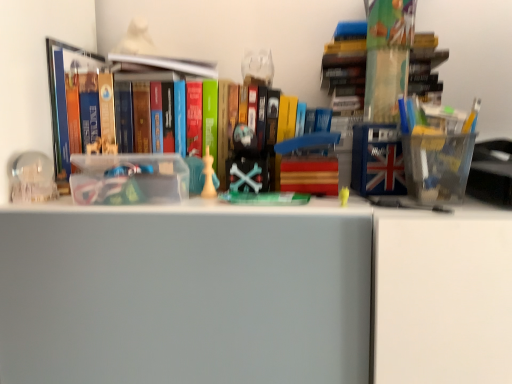
Question: From a real-world perspective, is transparent glass sphere at left, which appears as the 2th toy when viewed from the right, physically located above or below hardcover book at center, which ranks as the 2th book in left-to-right order?

Choices:
 (A) above
 (B) below

Answer: (B)

Question: Looking at the image, does transparent glass sphere at left, the 1th toy when ordered from left to right, seem bigger or smaller compared to hardcover book at center, which ranks as the 2th book in left-to-right order?

Choices:
 (A) big
 (B) small

Answer: (B)

Question: Based on their relative distances, which object is farther from the hardcover book at center, which is the 2th book from right to left?

Choices:
 (A) transparent glass sphere at left, which appears as the 2th toy when viewed from the right
 (B) white matte chess piece at center, which appears as the first toy when viewed from the right
 (C) hardcover book at upper center, marked as the third book in a right-to-left arrangement
 (D) translucent plastic container at upper right, which appears as the 1th book when viewed from the right

Answer: (D)

Question: Which object is positioned closest to the hardcover book at upper center, which is the first book from left to right?

Choices:
 (A) transparent glass sphere at left, which appears as the 2th toy when viewed from the right
 (B) translucent plastic container at upper right, which appears as the 1th book when viewed from the right
 (C) white matte chess piece at center, the second toy from the left
 (D) hardcover book at center, which is the 2th book from right to left

Answer: (D)